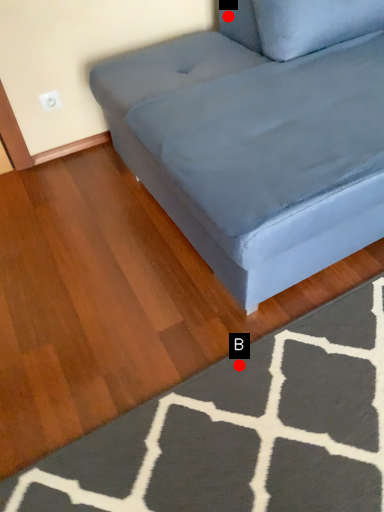
Question: Two points are circled on the image, labeled by A and B beside each circle. Among these points, which one is farthest from the camera?

Choices:
 (A) A is further
 (B) B is further

Answer: (A)